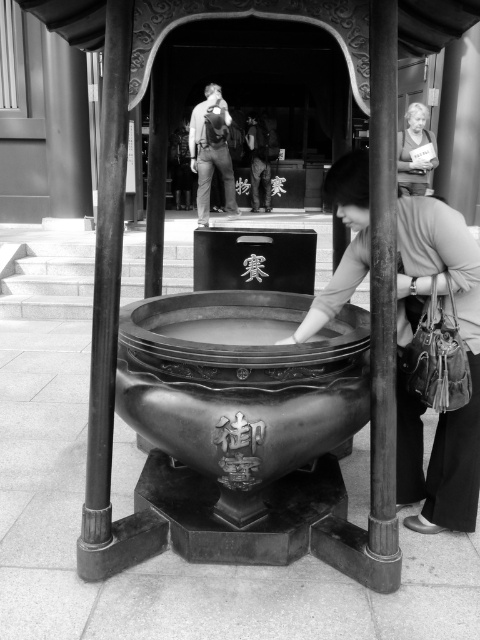
Question: Which point appears farthest from the camera in this image?

Choices:
 (A) (219, 168)
 (B) (373, 445)

Answer: (A)

Question: Which object is closer to the camera taking this photo?

Choices:
 (A) matte gray hair at upper right
 (B) matte black backpack at center
 (C) smooth wood pole at right
 (D) matte bronze bowl at center

Answer: (C)

Question: From the image, what is the correct spatial relationship of matte bronze bowl at center in relation to matte gray hair at upper right?

Choices:
 (A) right
 (B) left

Answer: (B)

Question: Does matte black backpack at center have a larger size compared to matte gray hair at upper right?

Choices:
 (A) no
 (B) yes

Answer: (B)

Question: Can you confirm if polished bronze pole at left is bigger than matte gray hair at upper right?

Choices:
 (A) no
 (B) yes

Answer: (A)

Question: Which of these objects is positioned closest to the smooth wood pole at right?

Choices:
 (A) matte black backpack at center
 (B) matte bronze bowl at center
 (C) polished bronze pole at left
 (D) matte gray hair at upper right

Answer: (B)